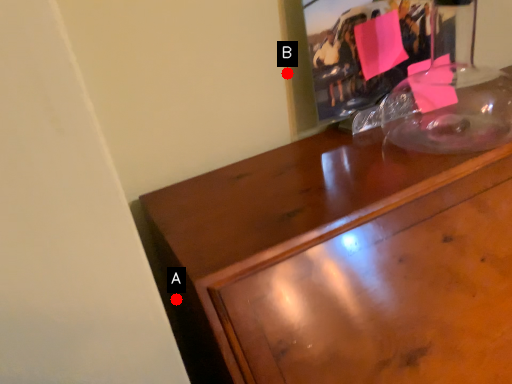
Question: Two points are circled on the image, labeled by A and B beside each circle. Which point is further to the camera?

Choices:
 (A) A is further
 (B) B is further

Answer: (B)